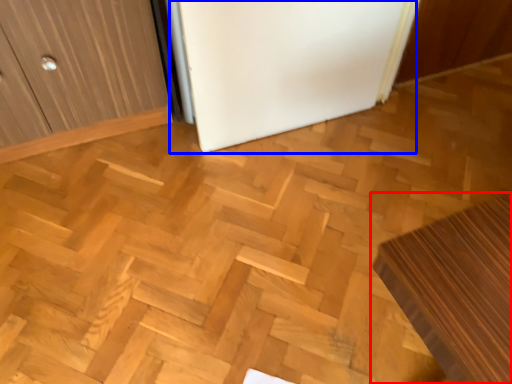
Question: Which point is further to the camera, furniture (highlighted by a red box) or fridge (highlighted by a blue box)?

Choices:
 (A) furniture
 (B) fridge

Answer: (B)